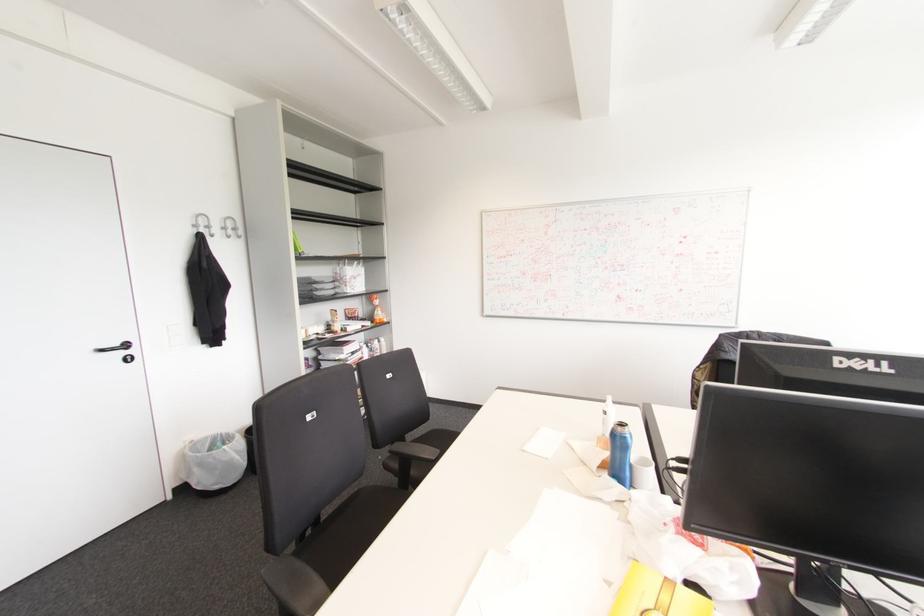
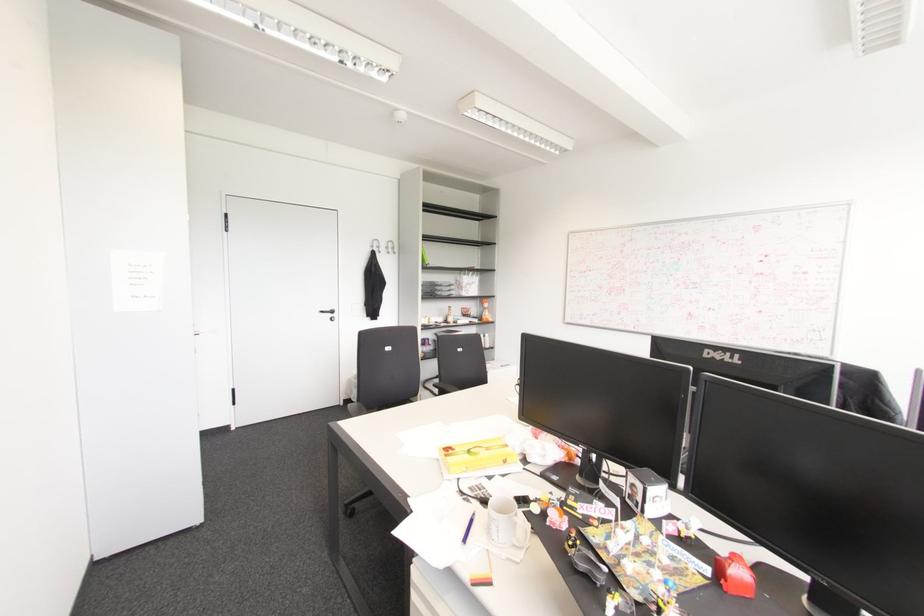
The images are taken continuously from a first-person perspective. In which direction are you moving?

The cameraman walked toward right, backward.